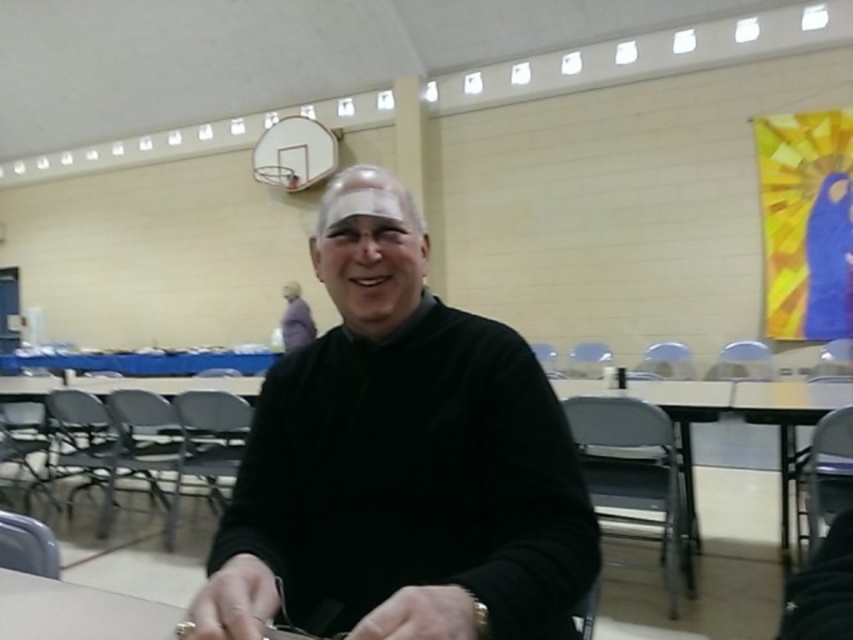
Question: Does black matte sweater at center appear under black plastic table at center?

Choices:
 (A) no
 (B) yes

Answer: (A)

Question: Estimate the real-world distances between objects in this image. Which object is closer to the smooth plastic table at center?

Choices:
 (A) black matte sweater at center
 (B) black plastic table at center

Answer: (B)

Question: Which object is the farthest from the black plastic table at center?

Choices:
 (A) smooth plastic table at center
 (B) black matte sweater at center

Answer: (B)

Question: Is black matte sweater at center to the left of black plastic table at center from the viewer's perspective?

Choices:
 (A) no
 (B) yes

Answer: (B)

Question: Observing the image, what is the correct spatial positioning of black matte sweater at center in reference to smooth plastic table at center?

Choices:
 (A) right
 (B) left

Answer: (B)

Question: Which point is closer to the camera?

Choices:
 (A) (654, 392)
 (B) (306, 518)

Answer: (B)